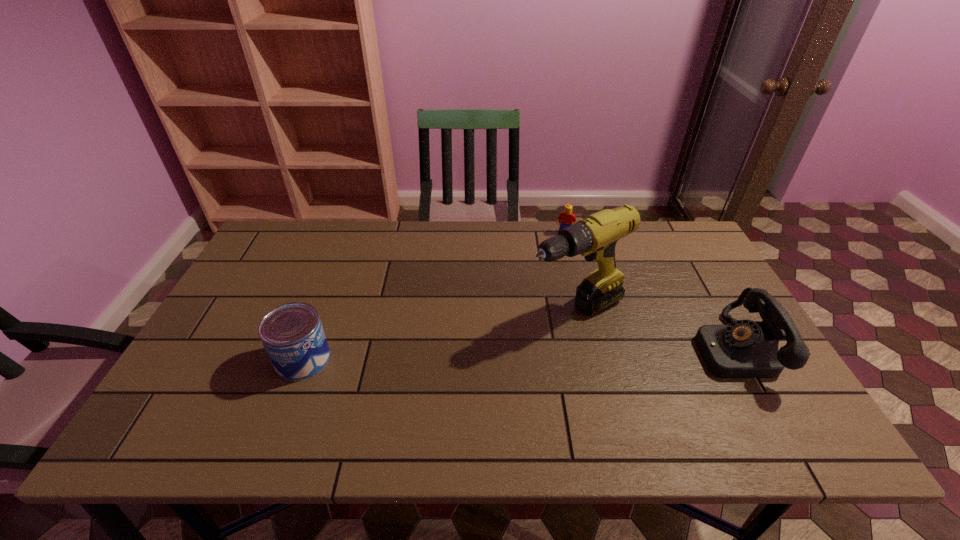
The image size is (960, 540). In order to click on free spot on the desktop that is between the leftmost object and the rightmost object and is positioned on the handle side of the tallest object in this screenshot , I will do `click(491, 354)`.

This screenshot has width=960, height=540. I want to click on free space on the desktop that is between the can and the rightmost object and is positioned on the face of the Lego, so click(x=529, y=354).